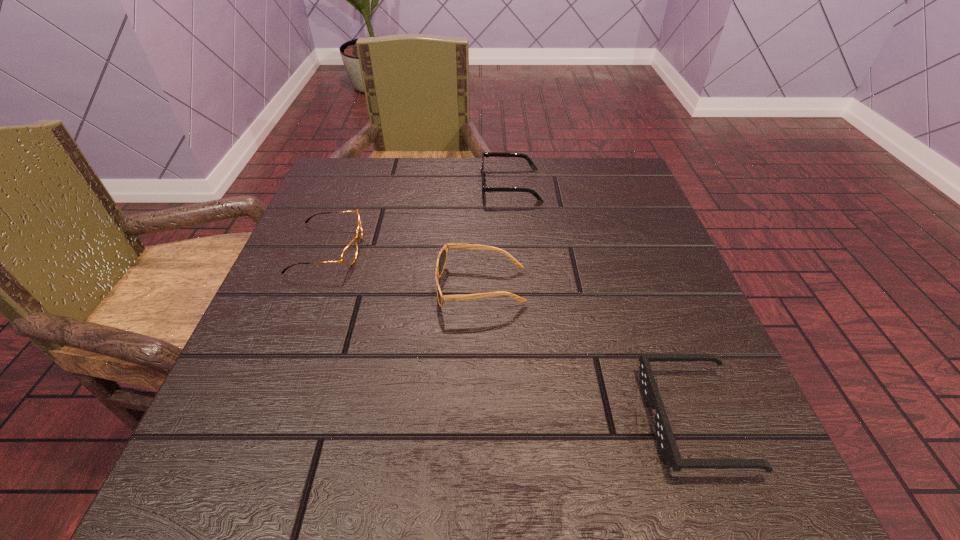
I want to click on the farthest object, so click(x=484, y=154).

This screenshot has height=540, width=960. Find the location of `the second nearest sunglasses`. the second nearest sunglasses is located at coordinates 442,257.

I want to click on the leftmost object, so click(x=349, y=254).

The height and width of the screenshot is (540, 960). Identify the location of the shortest sunglasses. (665, 439).

This screenshot has height=540, width=960. Identify the location of the shortest object. (665, 439).

The width and height of the screenshot is (960, 540). Find the location of `free space located on the front-facing side of the farthest sunglasses`. free space located on the front-facing side of the farthest sunglasses is located at coordinates (412, 185).

Find the location of a particular element. The width and height of the screenshot is (960, 540). free location located on the front-facing side of the farthest sunglasses is located at coordinates (403, 185).

I want to click on vacant area situated 0.320m on the front-facing side of the farthest sunglasses, so click(x=344, y=185).

This screenshot has width=960, height=540. What are the coordinates of `free space located on the front-facing side of the second nearest sunglasses` in the screenshot? It's located at (387, 287).

Identify the location of free point located on the front-facing side of the second nearest sunglasses. (320, 287).